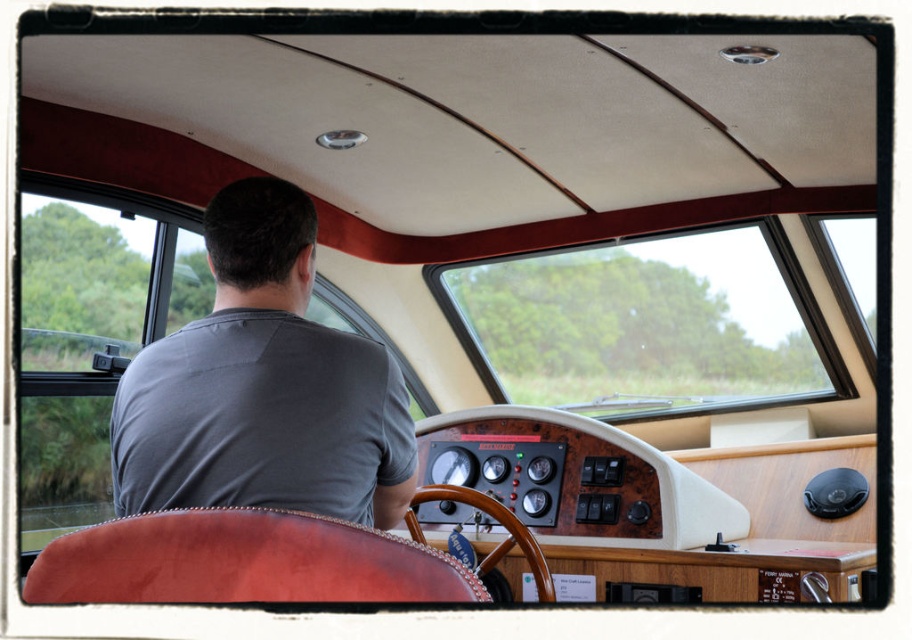
Who is higher up, gray cotton shirt at center or wooden at center?

gray cotton shirt at center is above.

Between gray cotton shirt at center and wooden at center, which one appears on the left side from the viewer's perspective?

Positioned to the left is gray cotton shirt at center.

At what (x,y) coordinates should I click in order to perform the action: click on gray cotton shirt at center. Please return your answer as a coordinate pair (x, y). Looking at the image, I should click on coord(262,387).

At what (x,y) coordinates should I click in order to perform the action: click on gray cotton shirt at center. Please return your answer as a coordinate pair (x, y). Looking at the image, I should click on (262, 387).